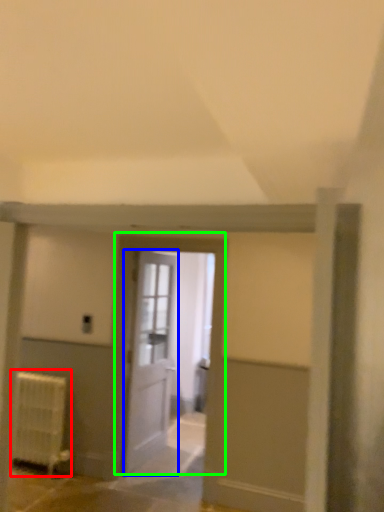
Question: Which object is positioned farthest from radiator (highlighted by a red box)? Select from door (highlighted by a blue box) and door (highlighted by a green box).

Choices:
 (A) door
 (B) door

Answer: (B)